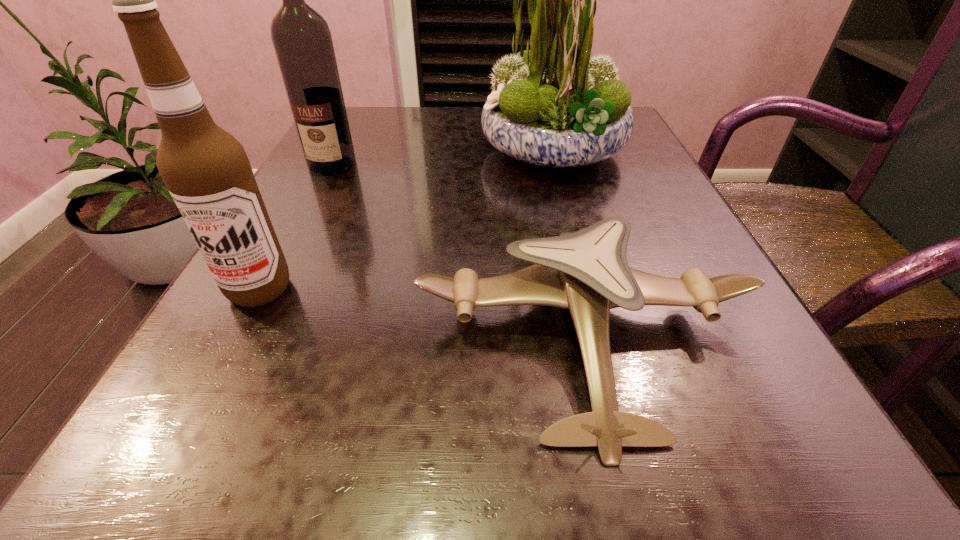
The height and width of the screenshot is (540, 960). Identify the location of vacant space that satisfies the following two spatial constraints: 1. on the front-facing side of the flower arrangement; 2. on the front-facing side of the shortest object. (604, 337).

The image size is (960, 540). What are the coordinates of `free spot that satisfies the following two spatial constraints: 1. on the front-facing side of the flower arrangement; 2. on the front-facing side of the drone` in the screenshot? It's located at (604, 337).

This screenshot has width=960, height=540. I want to click on free space that satisfies the following two spatial constraints: 1. on the front-facing side of the flower arrangement; 2. on the front and back of the farther alcohol, so click(558, 165).